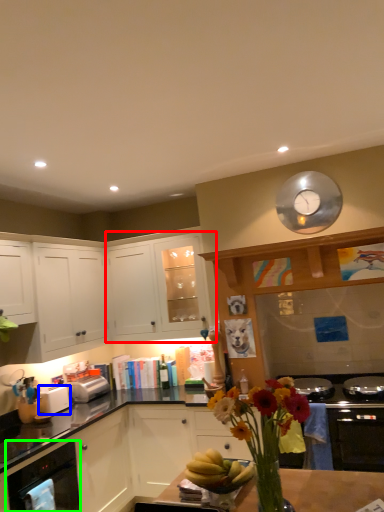
Question: Estimate the real-world distances between objects in this image. Which object is farther from cabinetry (highlighted by a red box), toaster (highlighted by a blue box) or kitchen appliance (highlighted by a green box)?

Choices:
 (A) toaster
 (B) kitchen appliance

Answer: (B)